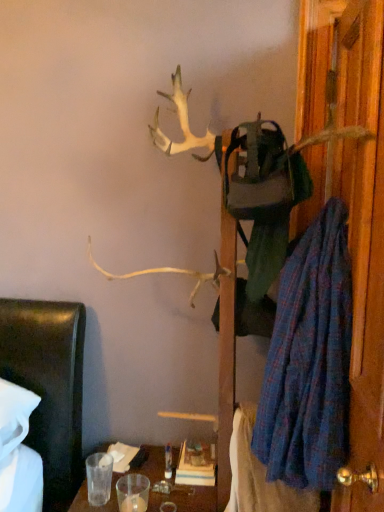
Question: Can you confirm if blue plaid robe at right is positioned to the right of wooden door at right?

Choices:
 (A) yes
 (B) no

Answer: (B)

Question: Is blue plaid robe at right completely or partially outside of wooden door at right?

Choices:
 (A) yes
 (B) no

Answer: (A)

Question: From the image's perspective, is blue plaid robe at right on wooden door at right?

Choices:
 (A) yes
 (B) no

Answer: (B)

Question: Is blue plaid robe at right further to camera compared to wooden door at right?

Choices:
 (A) yes
 (B) no

Answer: (A)

Question: Would you say wooden door at right is part of blue plaid robe at right's contents?

Choices:
 (A) yes
 (B) no

Answer: (B)

Question: From a real-world perspective, does blue plaid robe at right sit lower than wooden door at right?

Choices:
 (A) no
 (B) yes

Answer: (B)

Question: Are blue plaid blanket at lower right and blue plaid robe at right beside each other?

Choices:
 (A) yes
 (B) no

Answer: (B)

Question: Is blue plaid blanket at lower right in front of blue plaid robe at right?

Choices:
 (A) yes
 (B) no

Answer: (B)

Question: Is blue plaid blanket at lower right not within blue plaid robe at right?

Choices:
 (A) yes
 (B) no

Answer: (A)

Question: Is blue plaid blanket at lower right at the left side of blue plaid robe at right?

Choices:
 (A) no
 (B) yes

Answer: (B)

Question: Is blue plaid blanket at lower right smaller than blue plaid robe at right?

Choices:
 (A) yes
 (B) no

Answer: (A)

Question: Can you confirm if blue plaid blanket at lower right is taller than blue plaid robe at right?

Choices:
 (A) yes
 (B) no

Answer: (B)

Question: From the image's perspective, is wooden door at right over blue plaid robe at right?

Choices:
 (A) no
 (B) yes

Answer: (B)